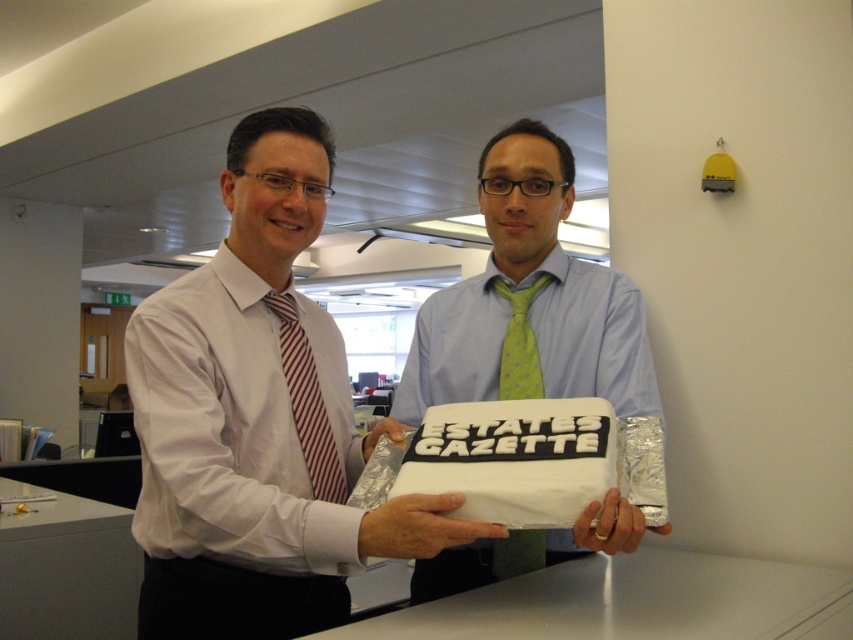
In the image, there are two people holding a cake. The person on the left is wearing a red and white striped tie, and the person on the right is wearing a green dotted tie at center. Which tie is closer to the camera?

The green dotted tie at center is closer to the camera because it is located at point (529, 301), which is closer to the viewer compared to the other tie.

You are a photographer taking a picture of the scene described. You notice a point at coordinates (x=529, y=301). What object is located at this point?

The point at coordinates (x=529, y=301) indicates the green dotted tie at center.

You are a photographer setting up for a group photo. You notice two cakes, the white matte cake at center and the white fondant cake at center, placed in the same area. Which cake should you position closer to the camera to ensure it is the main focus?

The white matte cake at center is already in front of the white fondant cake at center, so positioning it closer to the camera will keep it as the main focus.